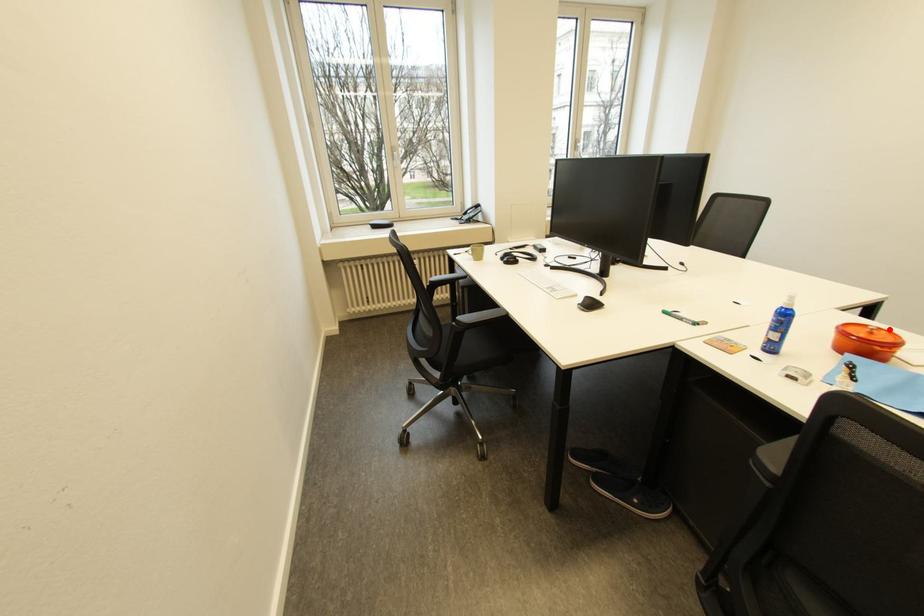
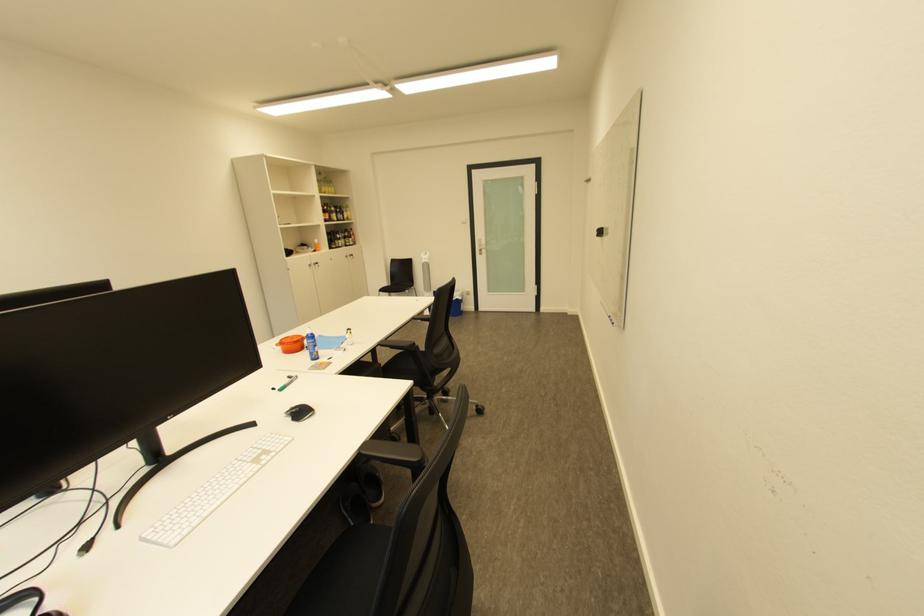
Locate, in the second image, the point that corresponds to the highlighted location in the first image.

(292, 341)